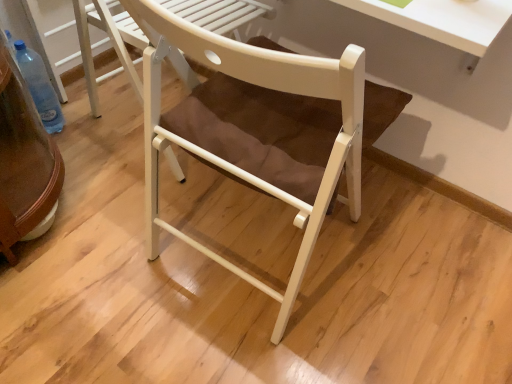
Question: In the image, is white matte chair at center, positioned as the 1th chair in back-to-front order, positioned in front of or behind white wood chair at center, which is counted as the second chair, starting from the back?

Choices:
 (A) front
 (B) behind

Answer: (B)

Question: Which is correct: white matte chair at center, positioned as the 1th chair in back-to-front order, is inside white wood chair at center, which is counted as the second chair, starting from the back, or outside of it?

Choices:
 (A) outside
 (B) inside

Answer: (A)

Question: Which is farther from the white wood chair at center, arranged as the 1th chair when viewed from the front?

Choices:
 (A) transparent plastic bottle at lower left
 (B) white matte chair at center, positioned as the 1th chair in back-to-front order

Answer: (A)

Question: Which of these objects is positioned farthest from the transparent plastic bottle at lower left?

Choices:
 (A) white wood chair at center, which is counted as the second chair, starting from the back
 (B) white matte chair at center, positioned as the 1th chair in back-to-front order

Answer: (A)